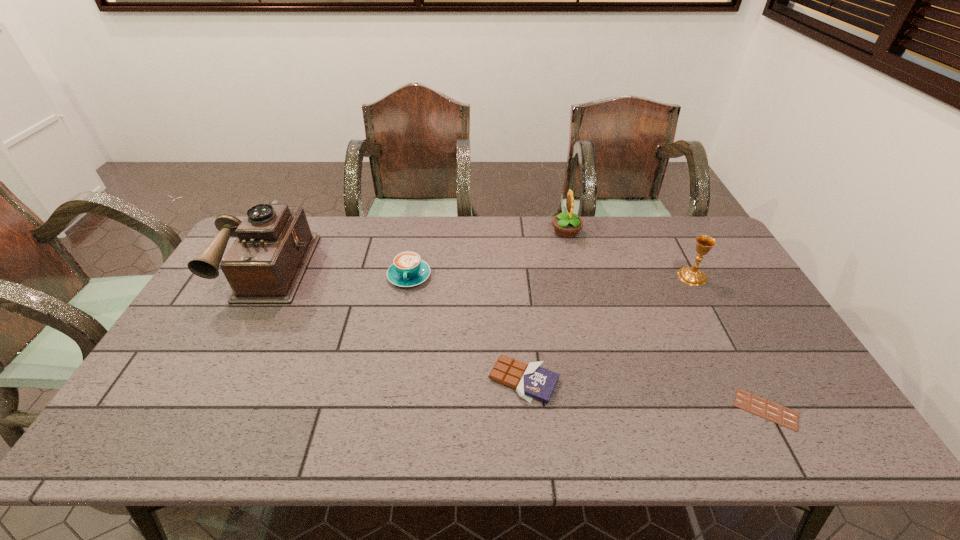
At what (x,y) coordinates should I click in order to perform the action: click on object located in the near edge section of the desktop. Please return your answer as a coordinate pair (x, y). This screenshot has width=960, height=540. Looking at the image, I should click on (786, 417).

At what (x,y) coordinates should I click in order to perform the action: click on object positioned at the left edge. Please return your answer as a coordinate pair (x, y). Looking at the image, I should click on (266, 263).

The height and width of the screenshot is (540, 960). I want to click on chalice that is at the right edge, so click(x=692, y=276).

What are the coordinates of `chocolate bar situated at the right edge` in the screenshot? It's located at (786, 417).

At what (x,y) coordinates should I click in order to perform the action: click on object that is positioned at the far left corner. Please return your answer as a coordinate pair (x, y). The height and width of the screenshot is (540, 960). Looking at the image, I should click on (266, 263).

Where is `object positioned at the near right corner`? object positioned at the near right corner is located at coordinates (786, 417).

Locate an element on the screen. vacant space at the far edge of the desktop is located at coordinates (429, 221).

At what (x,y) coordinates should I click in order to perform the action: click on free space at the near edge of the desktop. Please return your answer as a coordinate pair (x, y). This screenshot has width=960, height=540. Looking at the image, I should click on (375, 420).

At what (x,y) coordinates should I click in order to perform the action: click on vacant space at the left edge of the desktop. Please return your answer as a coordinate pair (x, y). This screenshot has width=960, height=540. Looking at the image, I should click on (209, 339).

Locate an element on the screen. The height and width of the screenshot is (540, 960). vacant region at the right edge of the desktop is located at coordinates (780, 361).